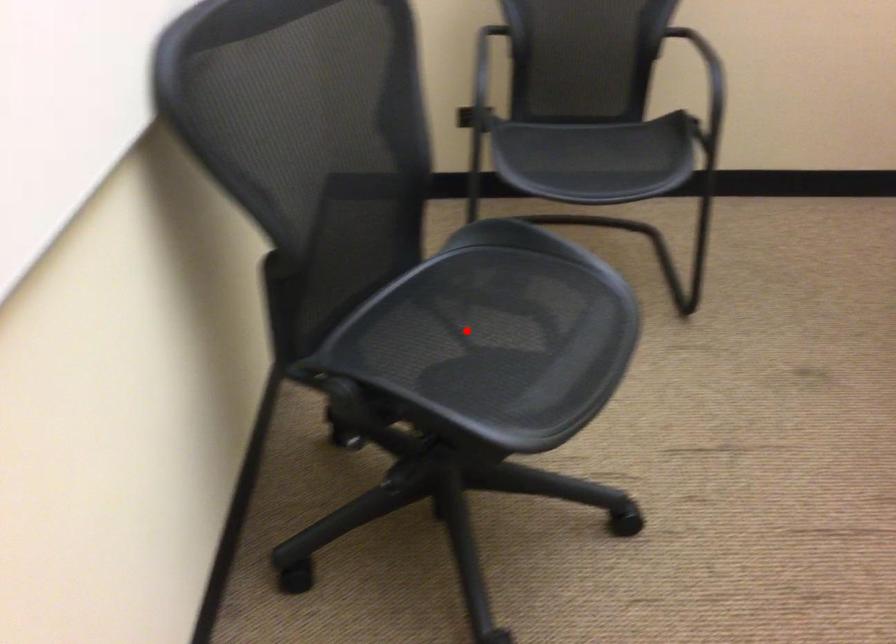
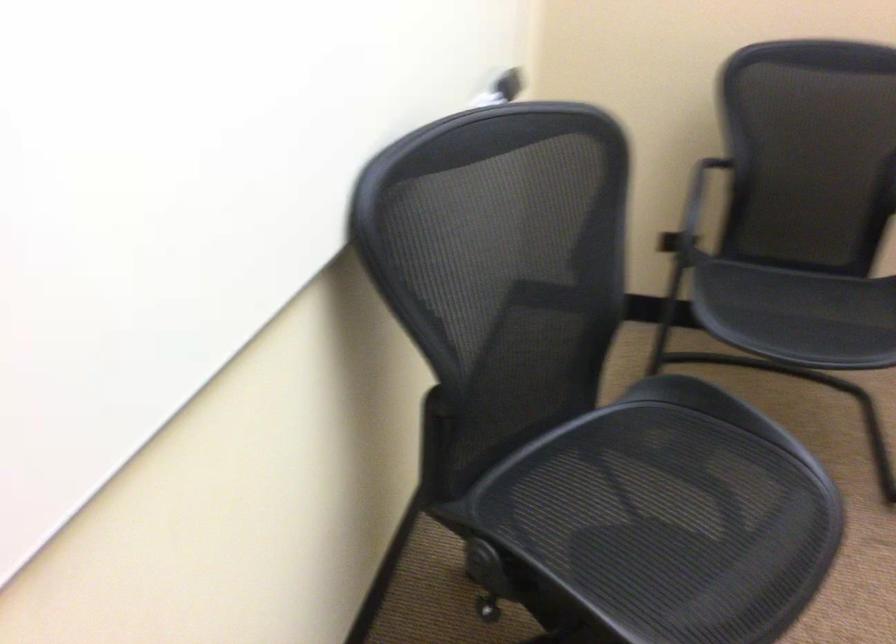
Question: A red point is marked in image1. In image2, is the corresponding 3D point closer to the camera or farther? Reply with the corresponding letter.

Choices:
 (A) The corresponding 3D point is closer.
 (B) The corresponding 3D point is farther.

Answer: (A)